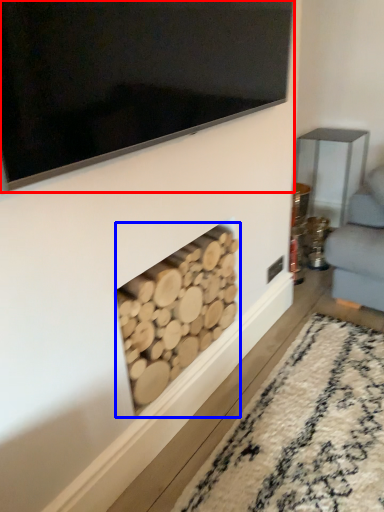
Question: Which object appears farthest to the camera in this image, television (highlighted by a red box) or fireplace (highlighted by a blue box)?

Choices:
 (A) television
 (B) fireplace

Answer: (B)